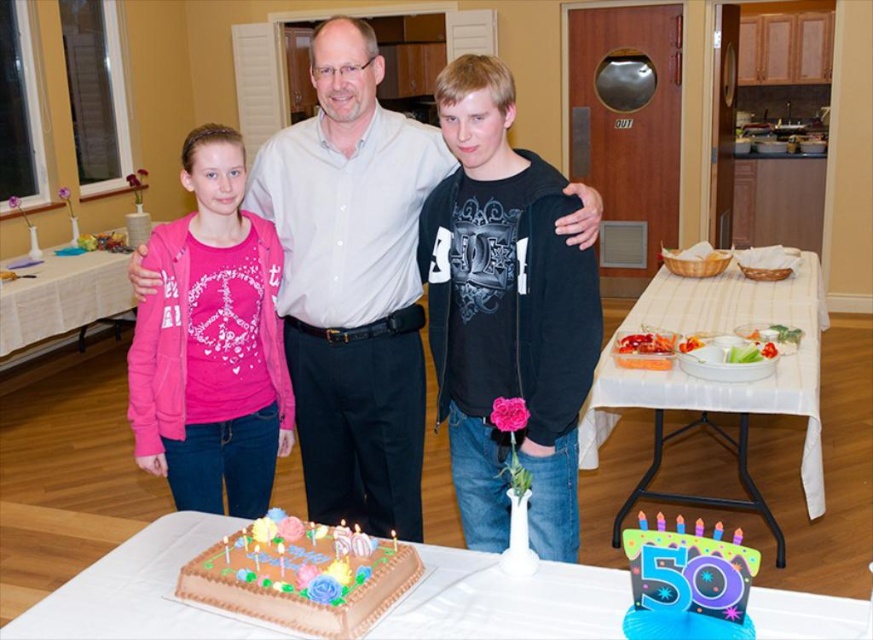
The image size is (873, 640). What do you see at coordinates (211, 342) in the screenshot?
I see `pink fleece jacket at left` at bounding box center [211, 342].

Is pink fleece jacket at left wider than chocolate frosted cake at center?

No, pink fleece jacket at left is not wider than chocolate frosted cake at center.

Who is more distant from viewer, (196,445) or (289,596)?

Positioned behind is point (196,445).

This screenshot has height=640, width=873. Find the location of `pink fleece jacket at left`. pink fleece jacket at left is located at coordinates [211, 342].

Who is lower down, chocolate frosted cake at center or white cloth table at lower left?

Positioned lower is chocolate frosted cake at center.

Does chocolate frosted cake at center have a lesser width compared to white cloth table at lower left?

Yes.

Measure the distance between point (x=212, y=557) and camera.

They are 1.55 meters apart.

Find the location of `chocolate frosted cake at center`. chocolate frosted cake at center is located at coordinates (301, 576).

Which is in front, point (784, 291) or point (53, 301)?

Point (784, 291) is more forward.

Between point (801, 451) and point (122, 304), which one is positioned behind?

The point (122, 304) is more distant.

This screenshot has width=873, height=640. What are the coordinates of `white plastic table at center` in the screenshot? It's located at (x=717, y=380).